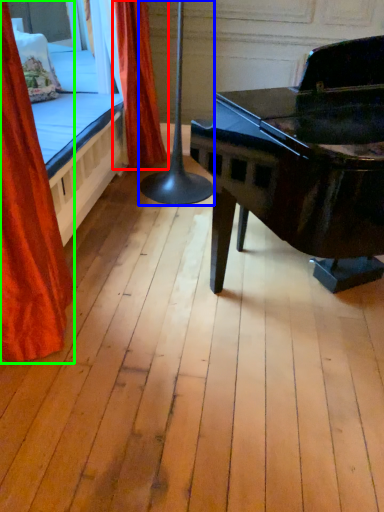
Question: Estimate the real-world distances between objects in this image. Which object is farther from curtain (highlighted by a red box), table lamp (highlighted by a blue box) or curtain (highlighted by a green box)?

Choices:
 (A) table lamp
 (B) curtain

Answer: (B)